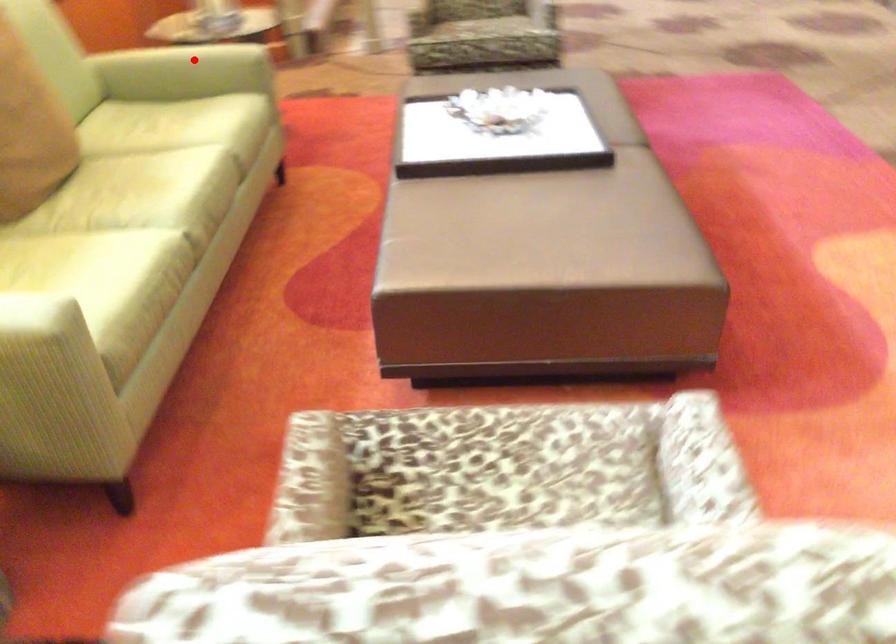
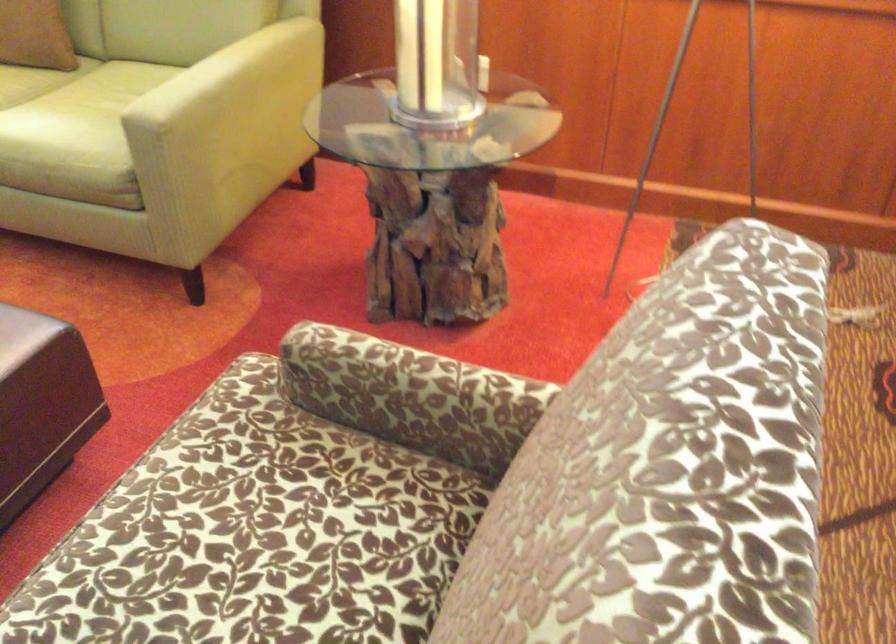
Question: I am providing you with two images of the same scene from different viewpoints. A red point is marked on the first image. Can you still see the location of the red point in image 2?

Choices:
 (A) Yes
 (B) No

Answer: (B)